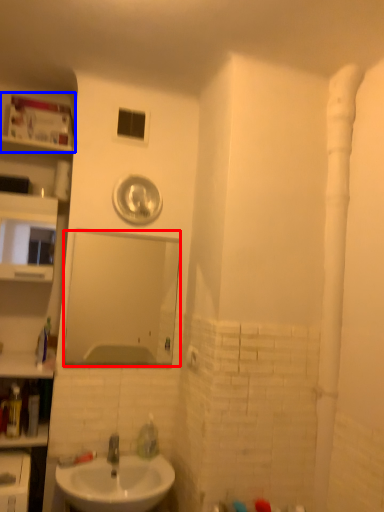
Question: Which object is further to the camera taking this photo, mirror (highlighted by a red box) or shelf (highlighted by a blue box)?

Choices:
 (A) mirror
 (B) shelf

Answer: (B)